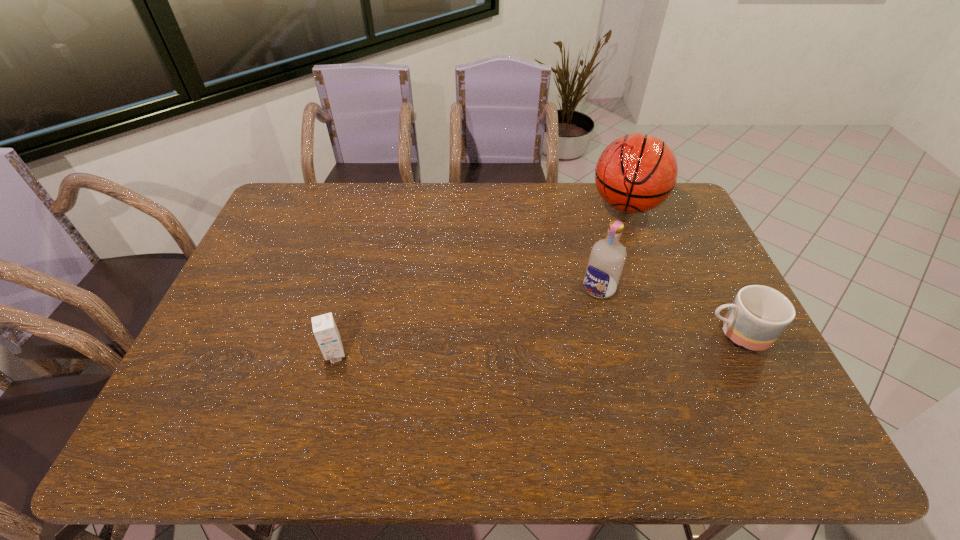
Where is `vacant space on the desktop that is between the leftmost object and the mug and is positioned on the side with spill of the basketball`? This screenshot has height=540, width=960. vacant space on the desktop that is between the leftmost object and the mug and is positioned on the side with spill of the basketball is located at coordinates (548, 343).

Image resolution: width=960 pixels, height=540 pixels. Identify the location of free space on the desktop that is between the chocolate milk and the mug and is positioned on the label of the third nearest object. (549, 343).